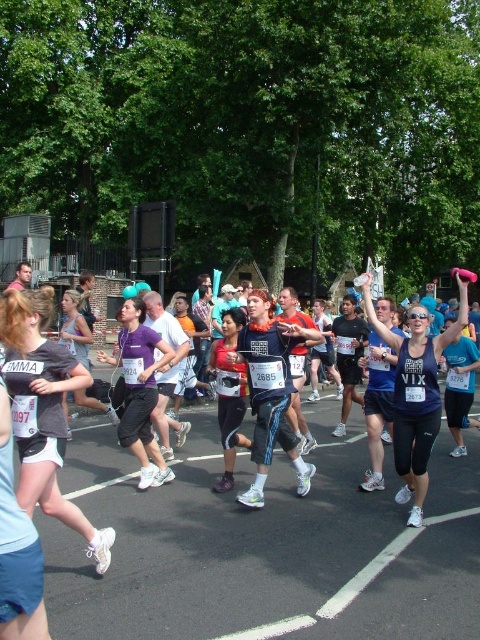
Is blue fabric tank top at center positioned at the back of purple matte tank top at center?

No, blue fabric tank top at center is closer to the viewer.

I want to click on blue fabric tank top at center, so click(x=417, y=390).

The image size is (480, 640). In order to click on blue fabric tank top at center in this screenshot , I will do `click(417, 390)`.

Is matte gray tank top at center wider than purple matte tank top at center?

No.

Between point (22, 417) and point (147, 410), which one is positioned behind?

The point (147, 410) is more distant.

Describe the element at coordinates (44, 413) in the screenshot. I see `matte gray tank top at center` at that location.

Locate an element on the screen. This screenshot has width=480, height=640. matte gray tank top at center is located at coordinates (44, 413).

Is purple matte tank top at center taller than matte red tank top at center?

Indeed, purple matte tank top at center has a greater height compared to matte red tank top at center.

Is point (123, 362) closer to camera compared to point (230, 372)?

Yes, point (123, 362) is in front of point (230, 372).

Is point (134, 433) less distant than point (245, 388)?

Yes.

I want to click on purple matte tank top at center, so [x=140, y=390].